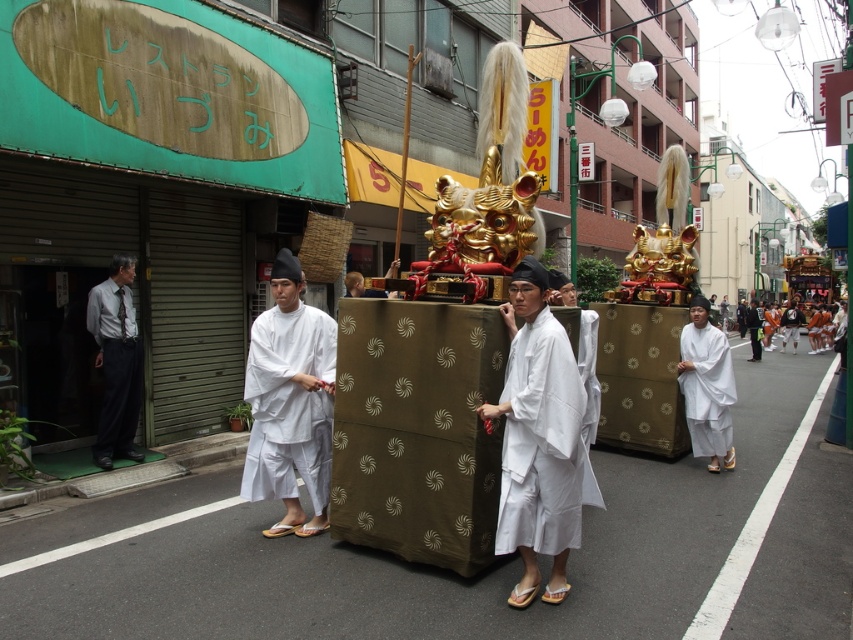
You are a photographer standing at the center of the street, and you want to take a photo of the festival float. There are two points marked in the scene. One is at coordinate point (100, 465) and the other is at coordinate point (689, 349). Which of these points is closer to your camera lens?

Point (100, 465) is closer to the camera than point (689, 349), so the photographer should focus on that point to capture the festival float more clearly.

You are a photographer standing in the middle of the street. You want to take a photo that includes both the gray shirt and tie at left and the white matte robe at right. Which person should you position closer to the camera to ensure both are fully visible in the frame?

Since the gray shirt and tie at left is much taller than the white matte robe at right, you should position the white matte robe at right closer to the camera to balance their sizes in the photo.